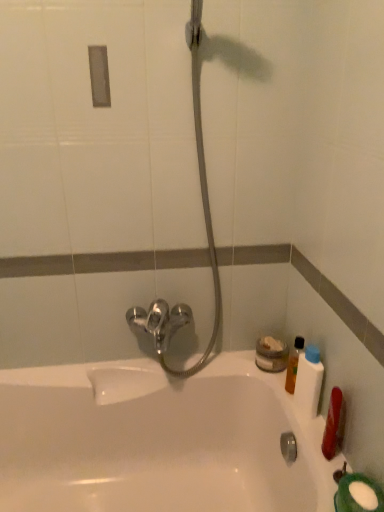
Question: In terms of size, does white plastic bottle at right, the second mouthwash from the back, appear bigger or smaller than white glossy bathtub at center?

Choices:
 (A) big
 (B) small

Answer: (B)

Question: From a real-world perspective, relative to white glossy bathtub at center, is white plastic bottle at right, the second mouthwash from the back, vertically above or below?

Choices:
 (A) above
 (B) below

Answer: (A)

Question: Which of these objects is positioned farthest from the satin nickel faucet at center?

Choices:
 (A) translucent plastic bottle at right, which appears as the 1th mouthwash when viewed from the back
 (B) white glossy bathtub at center
 (C) white plastic bottle at right, the second mouthwash from the back

Answer: (C)

Question: Estimate the real-world distances between objects in this image. Which object is farther from the translucent plastic bottle at right, marked as the 2th mouthwash in a front-to-back arrangement?

Choices:
 (A) white glossy bathtub at center
 (B) satin nickel faucet at center
 (C) white plastic bottle at right, arranged as the 1th mouthwash when viewed from the front

Answer: (A)